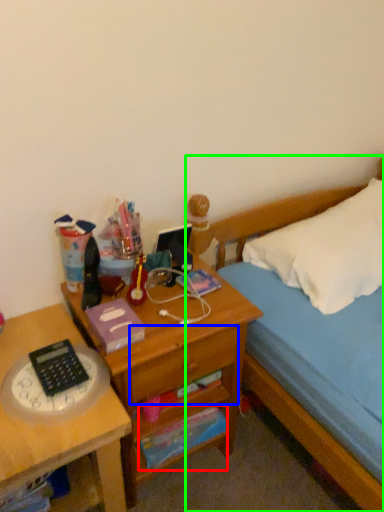
Question: Based on their relative distances, which object is nearer to paperback book (highlighted by a red box)? Choose from drawer (highlighted by a blue box) and bed (highlighted by a green box).

Choices:
 (A) drawer
 (B) bed

Answer: (A)